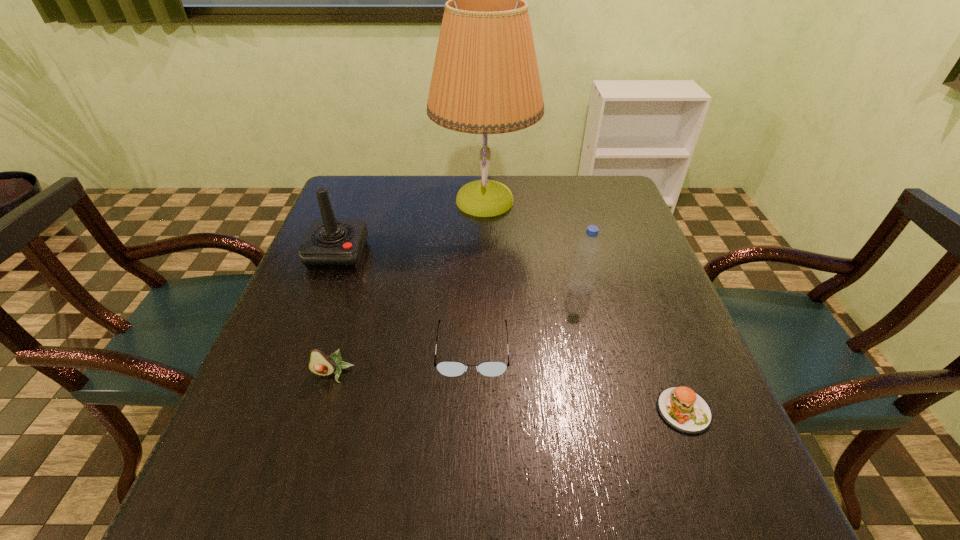
You are a GUI agent. You are given a task and a screenshot of the screen. Output one action in this format:
    pyautogui.click(x=<x>, y=<y>)
    Task: Click on the blank space located on the side of the farthest object near the pull switch
    The image size is (960, 540).
    Given the screenshot: What is the action you would take?
    pyautogui.click(x=403, y=200)

Identify the location of free space located on the side of the farthest object near the pull switch. This screenshot has width=960, height=540. (383, 200).

I want to click on free space located 0.290m on the front-facing side of the fifth nearest object, so click(x=294, y=370).

Where is `free space located on the front of the bottle`? The height and width of the screenshot is (540, 960). free space located on the front of the bottle is located at coordinates (595, 350).

I want to click on vacant space situated 0.180m on the seed side of the avocado, so click(x=301, y=479).

Find the location of a particular element. This screenshot has width=960, height=540. vacant point located on the lenses of the spectacles is located at coordinates (471, 421).

At what (x,y) coordinates should I click in order to perform the action: click on vacant space located 0.360m on the back of the nearest object. Please return your answer as a coordinate pair (x, y). Image resolution: width=960 pixels, height=540 pixels. Looking at the image, I should click on (628, 264).

Find the location of a particular element. The image size is (960, 540). object that is at the far edge is located at coordinates (485, 80).

Find the location of a particular element. This screenshot has height=540, width=960. joystick that is positioned at the left edge is located at coordinates (329, 244).

Locate an element on the screen. avocado located in the left edge section of the desktop is located at coordinates (320, 363).